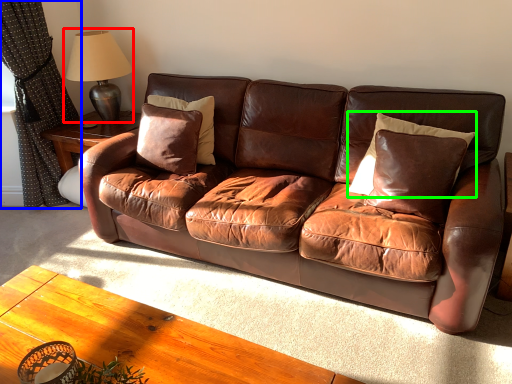
Question: Estimate the real-world distances between objects in this image. Which object is farther from table lamp (highlighted by a red box), curtain (highlighted by a blue box) or pillow (highlighted by a green box)?

Choices:
 (A) curtain
 (B) pillow

Answer: (B)